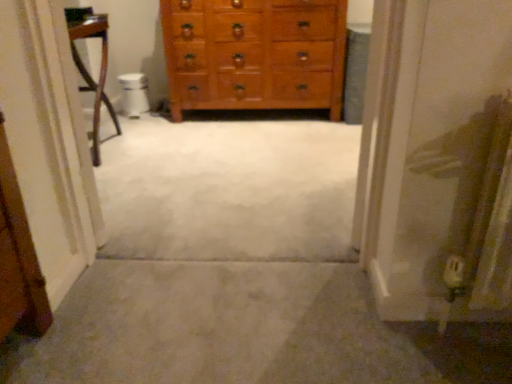
In order to click on white glossy toilet bowl at center in this screenshot , I will do `click(134, 94)`.

In the scene shown: Is wooden chest of drawers at center closer to the viewer compared to white glossy toilet bowl at center?

Yes, the depth of wooden chest of drawers at center is less than that of white glossy toilet bowl at center.

At what (x,y) coordinates should I click in order to perform the action: click on chest of drawers above the white glossy toilet bowl at center (from the image's perspective). Please return your answer as a coordinate pair (x, y). This screenshot has height=384, width=512. Looking at the image, I should click on (254, 54).

Considering the sizes of objects wooden chest of drawers at center and white glossy toilet bowl at center in the image provided, who is wider, wooden chest of drawers at center or white glossy toilet bowl at center?

wooden chest of drawers at center.

In the scene shown: Is wooden chest of drawers at center facing away from white glossy toilet bowl at center?

No.

From the image's perspective, is carpet at center located beneath white glossy toilet bowl at center?

Yes, from the image's perspective, carpet at center is below white glossy toilet bowl at center.

The height and width of the screenshot is (384, 512). Identify the location of toilet bowl behind the carpet at center. (134, 94).

Is carpet at center next to white glossy toilet bowl at center?

No, carpet at center is not next to white glossy toilet bowl at center.

What's the angular difference between carpet at center and white glossy toilet bowl at center's facing directions?

The angle between the facing direction of carpet at center and the facing direction of white glossy toilet bowl at center is 90.6 degrees.

Is the depth of wooden chest of drawers at center greater than that of carpet at center?

Yes.

Are wooden chest of drawers at center and carpet at center beside each other?

No, wooden chest of drawers at center is not next to carpet at center.

Which is more to the left, wooden chest of drawers at center or carpet at center?

wooden chest of drawers at center.

How many degrees apart are the facing directions of wooden chest of drawers at center and carpet at center?

There is a 90.1-degree angle between the facing directions of wooden chest of drawers at center and carpet at center.

From the image's perspective, relative to carpet at center, is white glossy toilet bowl at center above or below?

Clearly, from the image's perspective, white glossy toilet bowl at center is above carpet at center.

Does point (133, 80) appear closer or farther from the camera than point (269, 298)?

Point (133, 80) is farther from the camera than point (269, 298).

How many degrees apart are the facing directions of white glossy toilet bowl at center and carpet at center?

The angular difference between white glossy toilet bowl at center and carpet at center is 90.6 degrees.

Which object is further away from the camera, carpet at center or wooden chest of drawers at center?

wooden chest of drawers at center.

How different are the orientations of carpet at center and wooden chest of drawers at center in degrees?

90.1 degrees.

Could you tell me if carpet at center is turned towards wooden chest of drawers at center?

No, carpet at center is not facing towards wooden chest of drawers at center.

Does point (211, 337) come behind point (197, 35)?

That is False.

How different are the orientations of white glossy toilet bowl at center and wooden chest of drawers at center in degrees?

The facing directions of white glossy toilet bowl at center and wooden chest of drawers at center are 0.517 degrees apart.

Could you tell me if white glossy toilet bowl at center is facing wooden chest of drawers at center?

No, white glossy toilet bowl at center is not aimed at wooden chest of drawers at center.

From a real-world perspective, is white glossy toilet bowl at center beneath wooden chest of drawers at center?

Yes.

In terms of height, does white glossy toilet bowl at center look taller or shorter compared to wooden chest of drawers at center?

white glossy toilet bowl at center is shorter than wooden chest of drawers at center.

You are a GUI agent. You are given a task and a screenshot of the screen. Output one action in this format:
    pyautogui.click(x=<x>, y=<y>)
    Task: Click on the chest of drawers on the right of white glossy toilet bowl at center
    
    Given the screenshot: What is the action you would take?
    pyautogui.click(x=254, y=54)

Where is `path beneath the white glossy toilet bowl at center (from a real-world perspective)`? The height and width of the screenshot is (384, 512). path beneath the white glossy toilet bowl at center (from a real-world perspective) is located at coordinates (220, 328).

Estimate the real-world distances between objects in this image. Which object is closer to wooden chest of drawers at center, carpet at center or white glossy toilet bowl at center?

The object closer to wooden chest of drawers at center is white glossy toilet bowl at center.

Looking at the image, which one is located closer to white glossy toilet bowl at center, wooden chest of drawers at center or carpet at center?

wooden chest of drawers at center is closer to white glossy toilet bowl at center.

Estimate the real-world distances between objects in this image. Which object is closer to carpet at center, white glossy toilet bowl at center or wooden chest of drawers at center?

wooden chest of drawers at center lies closer to carpet at center than the other object.

Consider the image. Based on their spatial positions, is white glossy toilet bowl at center or carpet at center closer to wooden chest of drawers at center?

Among the two, white glossy toilet bowl at center is located nearer to wooden chest of drawers at center.

Which object lies further to the anchor point white glossy toilet bowl at center, carpet at center or wooden chest of drawers at center?

carpet at center is positioned further to the anchor white glossy toilet bowl at center.

Based on the photo, considering their positions, is wooden chest of drawers at center positioned further to carpet at center than white glossy toilet bowl at center?

Based on the image, white glossy toilet bowl at center appears to be further to carpet at center.

The height and width of the screenshot is (384, 512). I want to click on chest of drawers between carpet at center and white glossy toilet bowl at center in the front-back direction, so click(x=254, y=54).